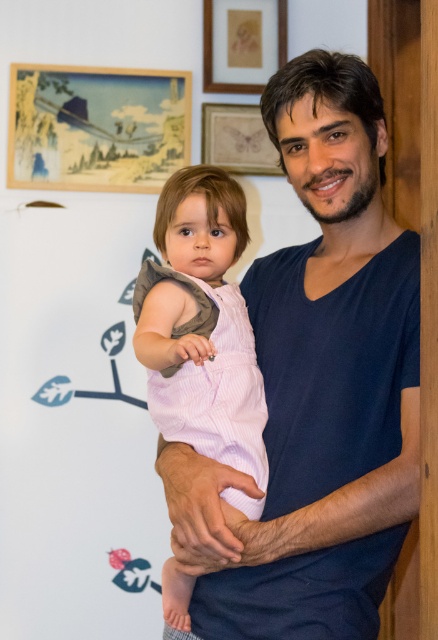
Is the position of dark blue t-shirt at center less distant than that of matte wooden picture frame at upper center?

Yes.

Does dark blue t-shirt at center appear on the left side of matte wooden picture frame at upper center?

Incorrect, dark blue t-shirt at center is not on the left side of matte wooden picture frame at upper center.

Who is more forward, (357, 168) or (202, 109)?

Point (357, 168)

Where is `dark blue t-shirt at center`? dark blue t-shirt at center is located at coordinates (317, 387).

Which of these two, gold textured frame at upper center or matte wooden picture frame at upper center, stands taller?

With more height is gold textured frame at upper center.

Is gold textured frame at upper center wider than matte wooden picture frame at upper center?

No.

This screenshot has height=640, width=438. I want to click on gold textured frame at upper center, so click(243, 44).

Locate an element on the screen. This screenshot has width=438, height=640. gold textured frame at upper center is located at coordinates point(243,44).

Looking at this image, is wooden picture frame at upper left taller than gold textured frame at upper center?

Correct, wooden picture frame at upper left is much taller as gold textured frame at upper center.

Between point (186, 134) and point (229, 90), which one is positioned behind?

Positioned behind is point (229, 90).

Image resolution: width=438 pixels, height=640 pixels. Describe the element at coordinates (96, 128) in the screenshot. I see `wooden picture frame at upper left` at that location.

I want to click on wooden picture frame at upper left, so click(x=96, y=128).